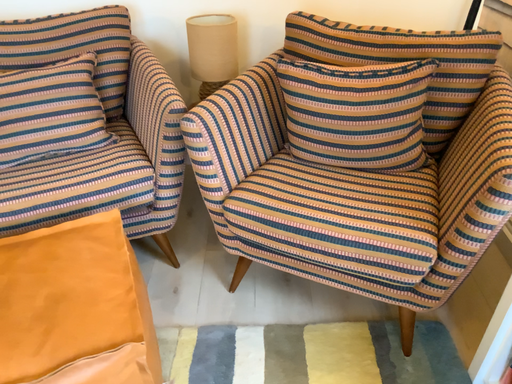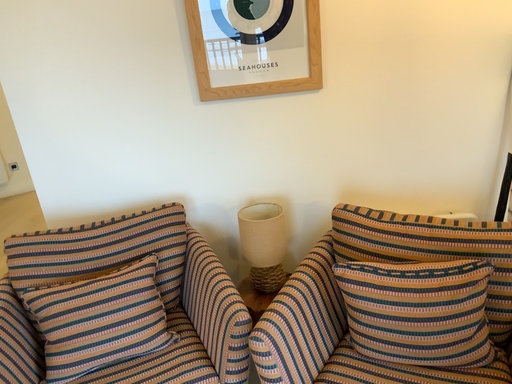
Question: Which way did the camera rotate in the video?

Choices:
 (A) rotated upward
 (B) rotated downward

Answer: (A)